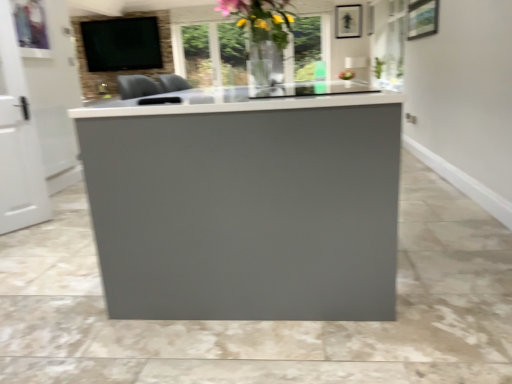
Where is `free space in front of white glossy door at left`? This screenshot has width=512, height=384. free space in front of white glossy door at left is located at coordinates (20, 239).